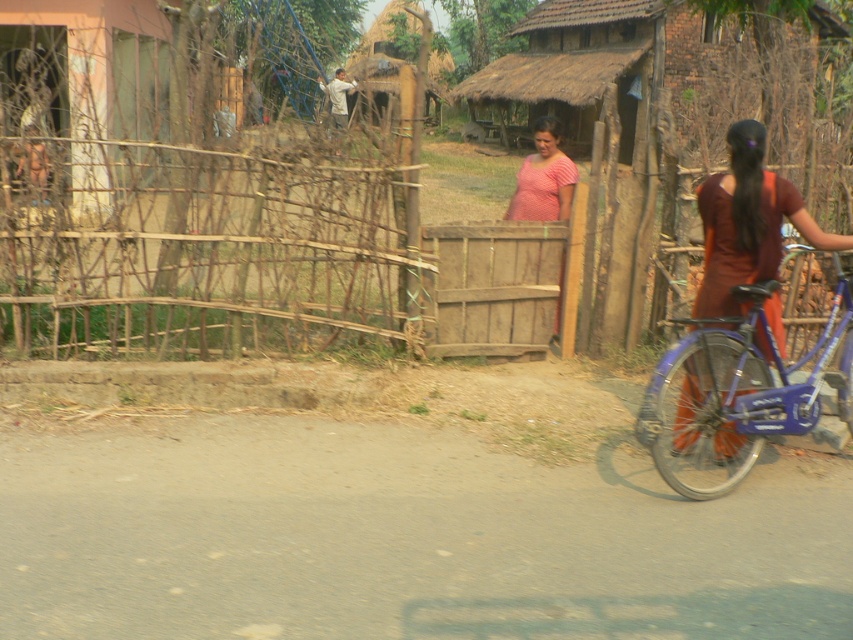
You are a traveler on the road and want to greet the woman in the pink striped shirt at center. Which direction should you go relative to the bare wood fence at left?

Answer: The bare wood fence at left is to the left of the pink striped shirt at center, so you should go to the right of the bare wood fence at left to reach the pink striped shirt at center.

You are a traveler standing on the paved road and see the bare wood fence at left and the pink striped shirt at center. Which object is closer to the road?

The bare wood fence at left is closer to the road because it is located below the pink striped shirt at center, indicating it is in a lower position relative to the road.

You are standing at the center of the paved road in the rural scene. You want to walk towards the bare wood fence at left. In which direction should you head?

The bare wood fence at left is located at point 0.388 on the x and y axis, so you should head towards the left direction to reach it.